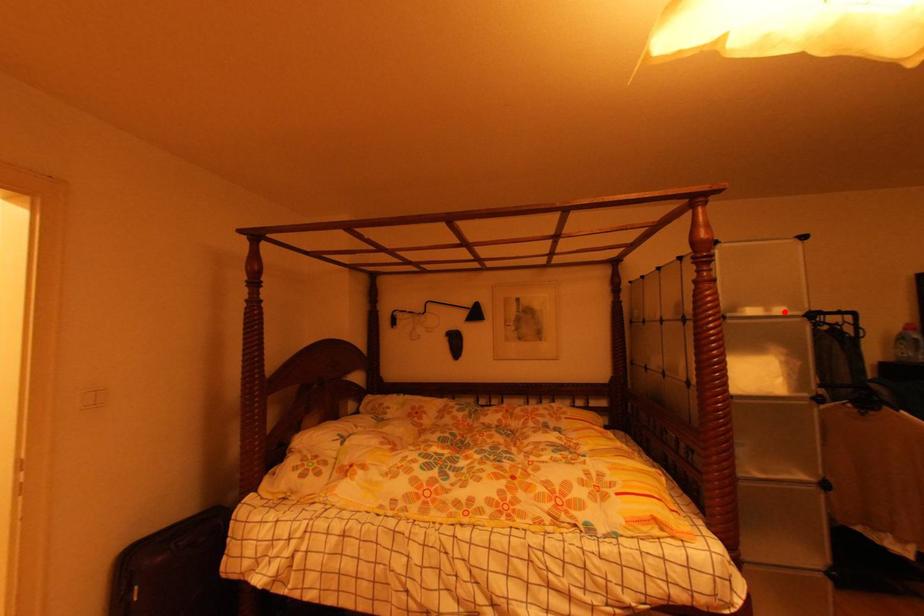
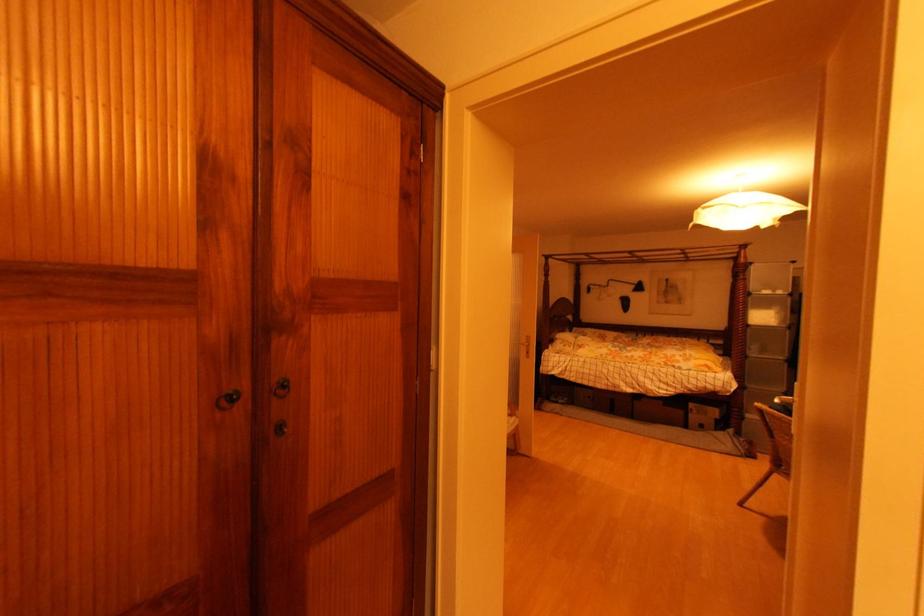
Locate, in the second image, the point that corresponds to the highlighted location in the first image.

(784, 294)